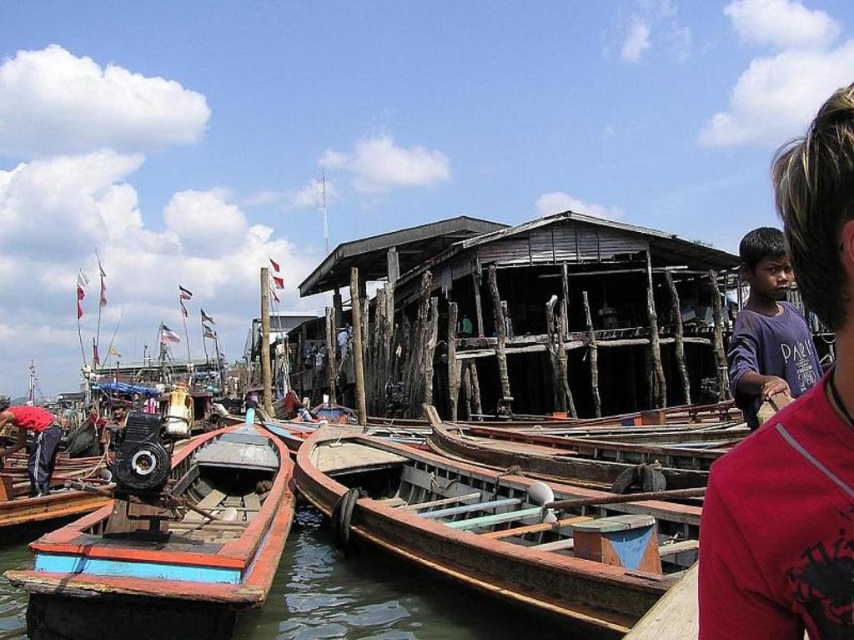
You are standing at the boat house and want to take a photo of both point (727, 465) and point (77, 586). Which point will appear larger in your photo?

Point (727, 465) is closer to the camera than point (77, 586), so it will appear larger in the photo.

You are a photographer planning to capture the wooden boat at center and the purple cotton shirt at upper right in the same frame. Based on their sizes, which object should you focus on first to ensure both are clearly visible in your shot?

The wooden boat at center is smaller than the purple cotton shirt at upper right, so you should focus on the wooden boat at center first to ensure both are clearly visible in your shot.